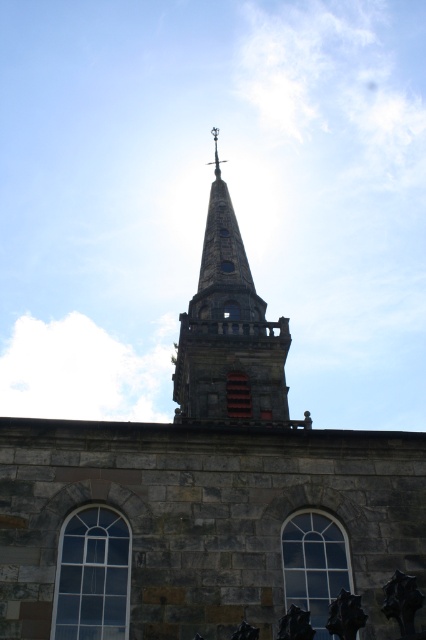
Question: From the image, what is the correct spatial relationship of clear glass window at lower left in relation to clear glass window at center?

Choices:
 (A) below
 (B) above

Answer: (B)

Question: Which object is positioned closest to the clear glass window at lower left?

Choices:
 (A) clear glass window at center
 (B) stone steeple at upper center

Answer: (A)

Question: Can you confirm if stone steeple at upper center is wider than clear glass window at center?

Choices:
 (A) yes
 (B) no

Answer: (A)

Question: Estimate the real-world distances between objects in this image. Which object is farther from the stone steeple at upper center?

Choices:
 (A) clear glass window at lower left
 (B) clear glass window at center

Answer: (B)

Question: Where is stone steeple at upper center located in relation to clear glass window at lower left in the image?

Choices:
 (A) above
 (B) below

Answer: (A)

Question: Which of the following is the farthest from the observer?

Choices:
 (A) (238, 228)
 (B) (88, 554)
 (C) (316, 572)

Answer: (A)